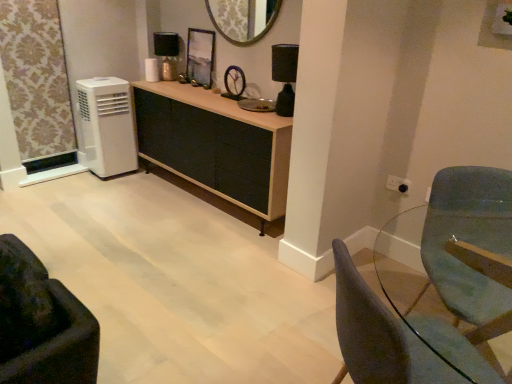
Locate an element on the screen. The height and width of the screenshot is (384, 512). vacant space situated on the left part of metallic reflective frame at center is located at coordinates (175, 86).